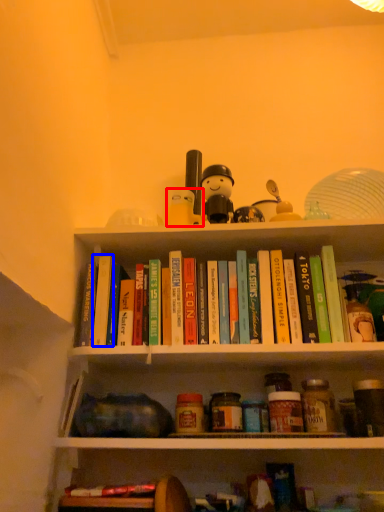
Question: Among these objects, which one is farthest to the camera, toy (highlighted by a red box) or paperback book (highlighted by a blue box)?

Choices:
 (A) toy
 (B) paperback book

Answer: (A)